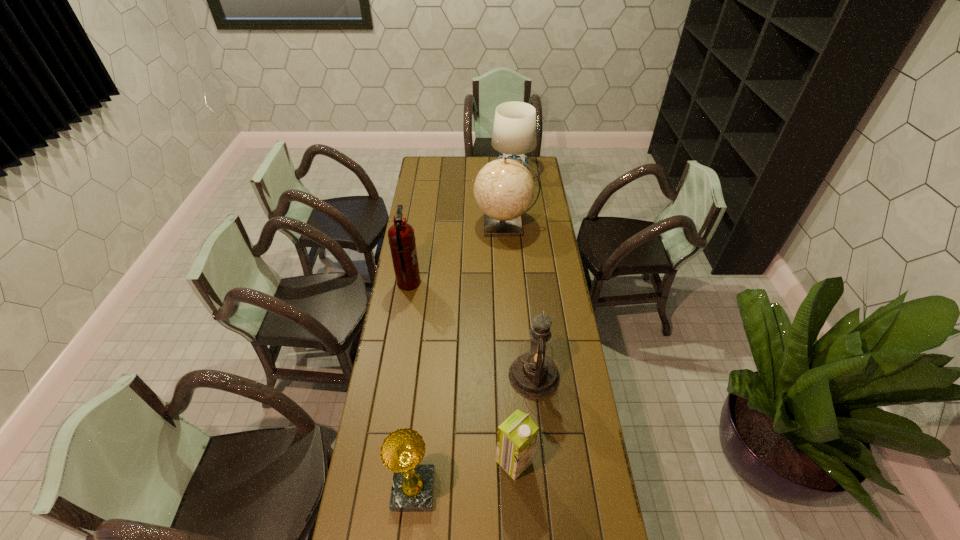
Where is `vacant region located on the front-facing side of the farthest object`? vacant region located on the front-facing side of the farthest object is located at coordinates (516, 210).

You are a GUI agent. You are given a task and a screenshot of the screen. Output one action in this format:
    pyautogui.click(x=<x>, y=<y>)
    Task: Click on the vacant region located 0.230m on the side of the third farthest object with the handle and hose
    The width and height of the screenshot is (960, 540).
    Given the screenshot: What is the action you would take?
    pyautogui.click(x=470, y=283)

Locate an element on the screen. The height and width of the screenshot is (540, 960). free space located 0.290m on the left of the third nearest object is located at coordinates (432, 376).

Identify the location of vacant space located 0.300m on the front-facing side of the fifth object from right to left. (529, 490).

The image size is (960, 540). I want to click on free spot located 0.290m on the back of the soya milk, so click(x=509, y=371).

Identify the location of object that is at the far edge. (514, 132).

Locate an element on the screen. This screenshot has width=960, height=540. fire extinguisher positioned at the left edge is located at coordinates (401, 236).

At what (x,y) coordinates should I click in order to perform the action: click on award that is at the left edge. Please return your answer as a coordinate pair (x, y). This screenshot has width=960, height=540. Looking at the image, I should click on (402, 451).

Where is `globe present at the right edge`? Image resolution: width=960 pixels, height=540 pixels. globe present at the right edge is located at coordinates (504, 189).

The image size is (960, 540). I want to click on lampshade that is positioned at the right edge, so click(x=514, y=132).